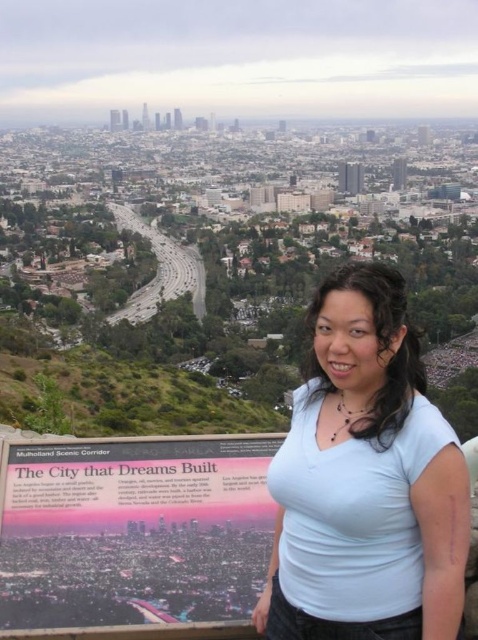
You are standing at the overlook and want to take a photo of the two points mentioned. Which point is closer to you, point (x=391, y=525) or point (x=262, y=545)?

Point (x=391, y=525) is closer to you than point (x=262, y=545).

Based on the photo, you are a tourist standing at the overlook and want to take a photo of the city skyline. However, there is an obstruction in the way. Based on the coordinates provided, where is the light blue fabric at center located relative to the city skyline in the background?

The light blue fabric at center is located at coordinates point (366, 481), which is in the foreground, blocking the view of the city skyline in the background.